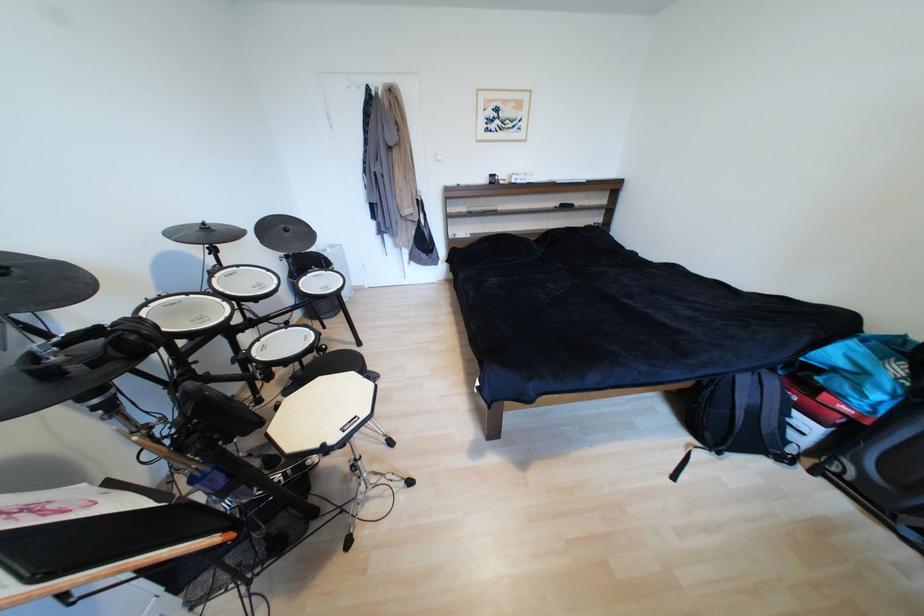
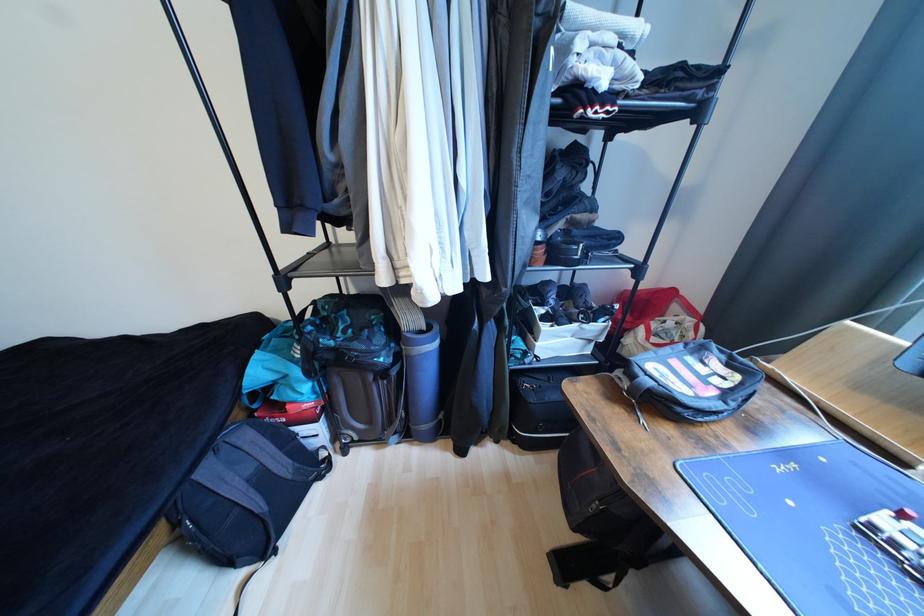
Find the pixel in the second image that matches the point at 751,381 in the first image.

(215, 472)